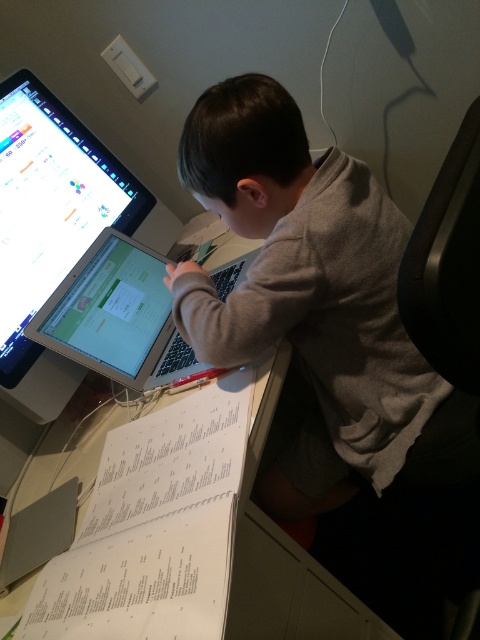
Is gray matte shirt at upper center thinner than silver metallic laptop at center?

In fact, gray matte shirt at upper center might be wider than silver metallic laptop at center.

Is point (384, 324) farther from viewer compared to point (69, 324)?

That is False.

What are the coordinates of `gray matte shirt at upper center` in the screenshot? It's located at (304, 289).

Does white paper at lower left appear over silver metallic laptop at center?

Actually, white paper at lower left is below silver metallic laptop at center.

Can you confirm if white paper at lower left is positioned below silver metallic laptop at center?

Indeed, white paper at lower left is positioned under silver metallic laptop at center.

What do you see at coordinates (154, 528) in the screenshot? The image size is (480, 640). I see `white paper at lower left` at bounding box center [154, 528].

You are a GUI agent. You are given a task and a screenshot of the screen. Output one action in this format:
    pyautogui.click(x=<x>, y=<y>)
    Task: Click on the white paper at lower left
    
    Given the screenshot: What is the action you would take?
    pyautogui.click(x=154, y=528)

Who is positioned more to the left, gray matte shirt at upper center or white paper at lower left?

From the viewer's perspective, white paper at lower left appears more on the left side.

Can you confirm if gray matte shirt at upper center is taller than white paper at lower left?

Yes, gray matte shirt at upper center is taller than white paper at lower left.

Between point (267, 337) and point (214, 616), which one is positioned in front?

Point (214, 616) is in front.

At what (x,y) coordinates should I click in order to perform the action: click on gray matte shirt at upper center. Please return your answer as a coordinate pair (x, y). The width and height of the screenshot is (480, 640). Looking at the image, I should click on (304, 289).